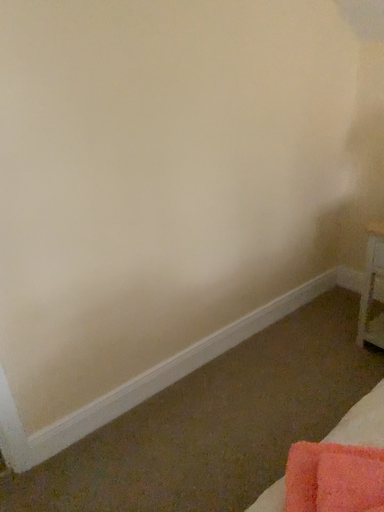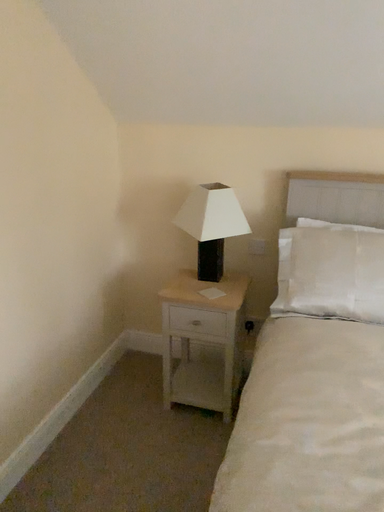
Question: Which way did the camera rotate in the video?

Choices:
 (A) rotated right
 (B) rotated left

Answer: (A)